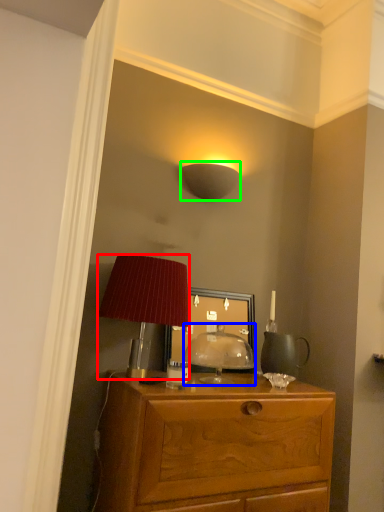
Question: Considering the real-world distances, which object is closest to lamp (highlighted by a red box)? table lamp (highlighted by a blue box) or lamp (highlighted by a green box).

Choices:
 (A) table lamp
 (B) lamp

Answer: (A)